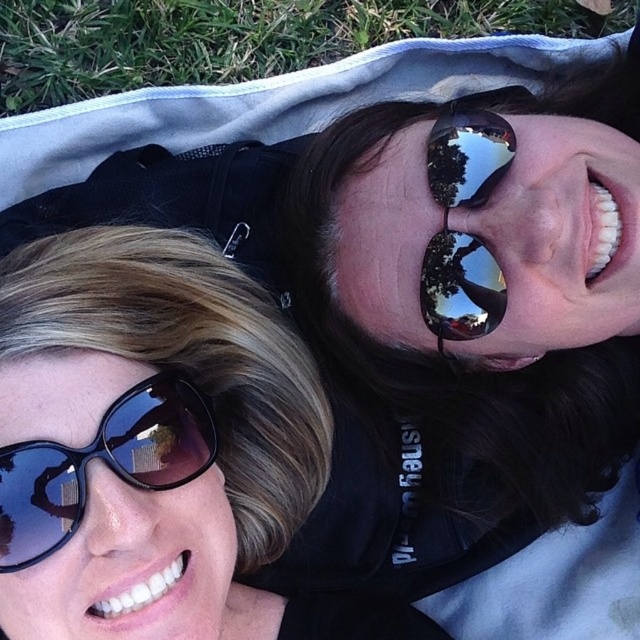
Question: Can you confirm if matte black sunglasses at upper left is wider than green grass at upper left?

Choices:
 (A) no
 (B) yes

Answer: (A)

Question: Is the position of matte black sunglasses at upper left less distant than that of green grass at upper left?

Choices:
 (A) yes
 (B) no

Answer: (A)

Question: Which of these objects is positioned farthest from the shiny reflective sunglasses at center?

Choices:
 (A) green grass at upper left
 (B) matte black sunglasses at upper left

Answer: (A)

Question: Which point is closer to the camera?

Choices:
 (A) (497, 170)
 (B) (220, 291)
 (C) (150, 77)

Answer: (B)

Question: Which of the following is the farthest from the observer?

Choices:
 (A) shiny reflective sunglasses at center
 (B) matte black sunglasses at upper left
 (C) green grass at upper left

Answer: (C)

Question: Can you confirm if matte black sunglasses at upper left is bigger than green grass at upper left?

Choices:
 (A) yes
 (B) no

Answer: (A)